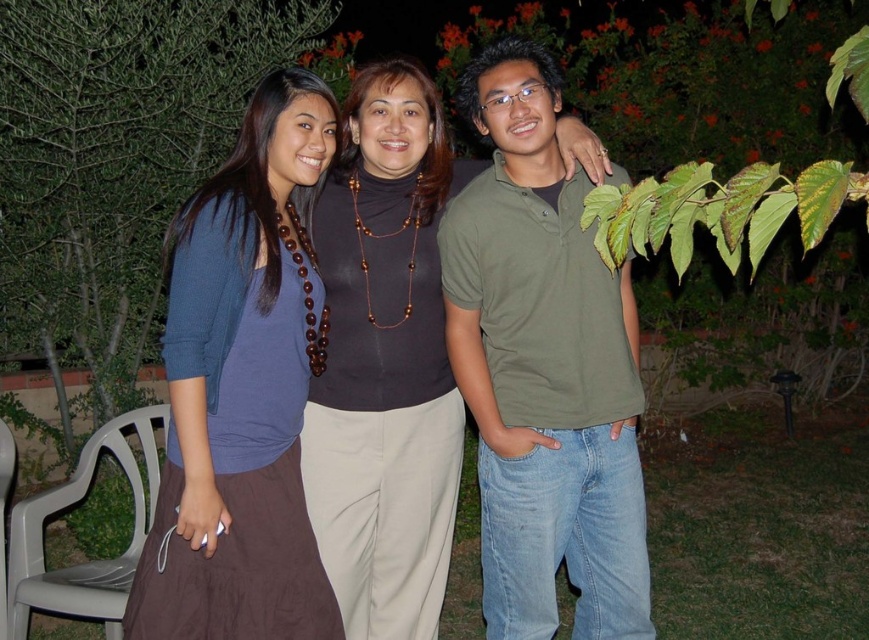
Question: Is matte blue blouse at center to the right of brown/beaded necklace at center from the viewer's perspective?

Choices:
 (A) yes
 (B) no

Answer: (B)

Question: Considering the real-world distances, which object is farthest from the green cotton polo shirt at center?

Choices:
 (A) brown/beaded necklace at center
 (B) matte blue blouse at center

Answer: (B)

Question: Which object appears farthest from the camera in this image?

Choices:
 (A) green leafy tree at upper center
 (B) green cotton polo shirt at center
 (C) brown/beaded necklace at center

Answer: (A)

Question: Is green cotton polo shirt at center closer to camera compared to matte blue blouse at center?

Choices:
 (A) no
 (B) yes

Answer: (A)

Question: Which point is closer to the camera?

Choices:
 (A) brown/beaded necklace at center
 (B) green leafy tree at upper center
 (C) matte blue blouse at center
 (D) green cotton polo shirt at center

Answer: (C)

Question: Observing the image, what is the correct spatial positioning of green cotton polo shirt at center in reference to green leafy tree at upper center?

Choices:
 (A) right
 (B) left

Answer: (A)